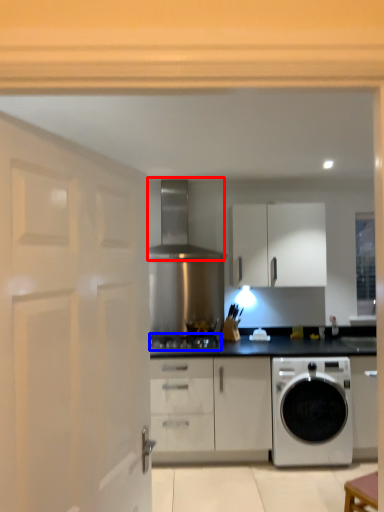
Question: Which object is closer to the camera taking this photo, exhaust hood (highlighted by a red box) or gas stove (highlighted by a blue box)?

Choices:
 (A) exhaust hood
 (B) gas stove

Answer: (B)